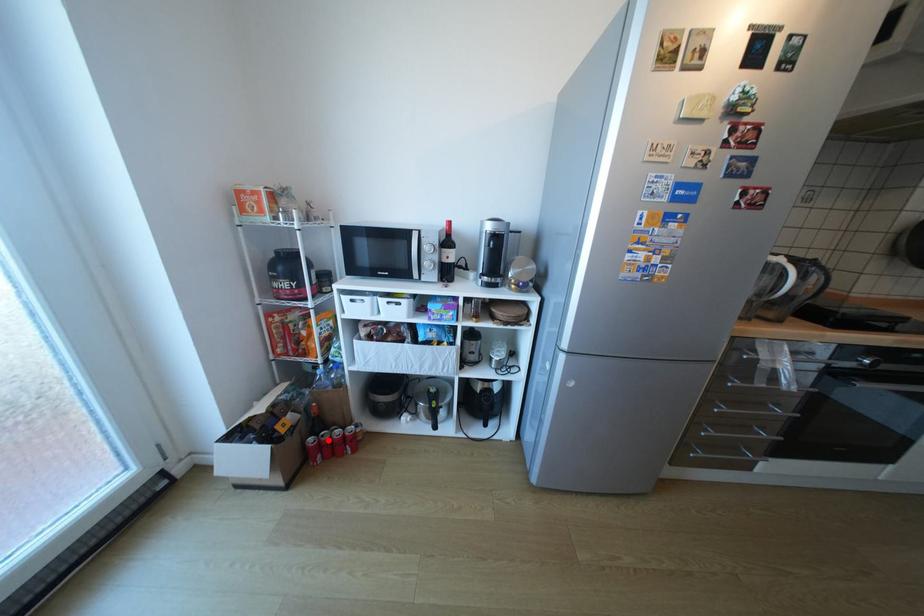
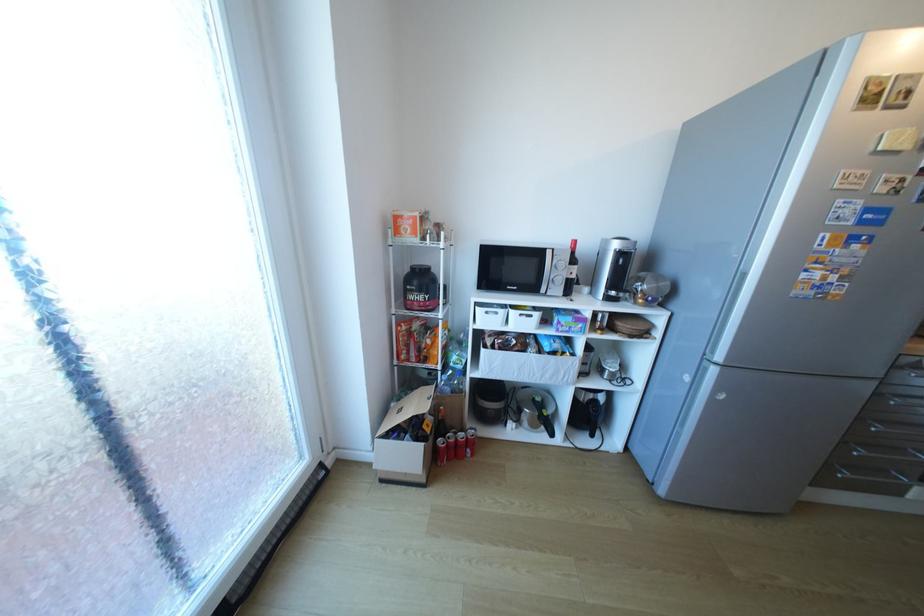
Question: I am providing you with two images of the same scene from different viewpoints. A red point is shown in image1. For the corresponding object point in image2, is it positioned nearer or farther from the camera?

Choices:
 (A) Nearer
 (B) Farther

Answer: (B)